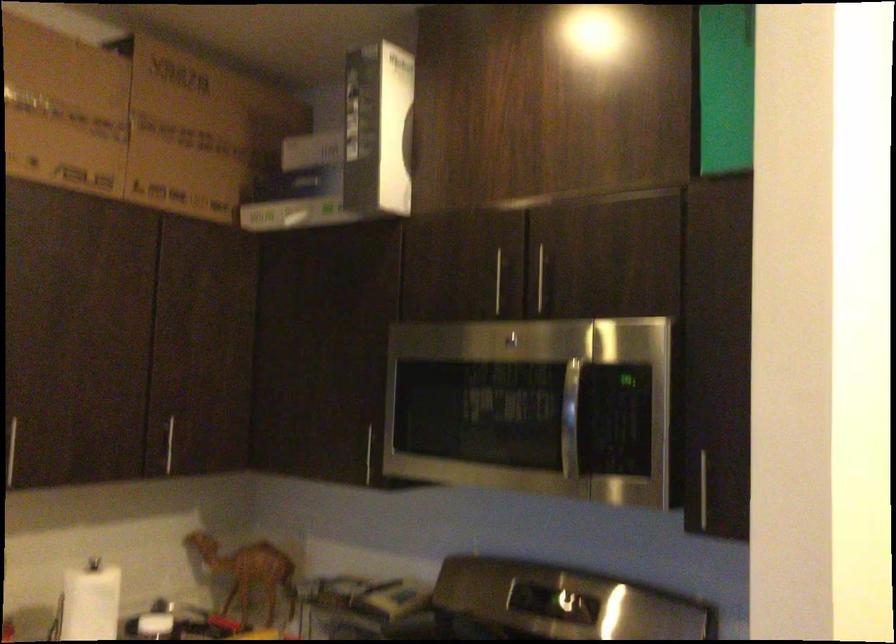
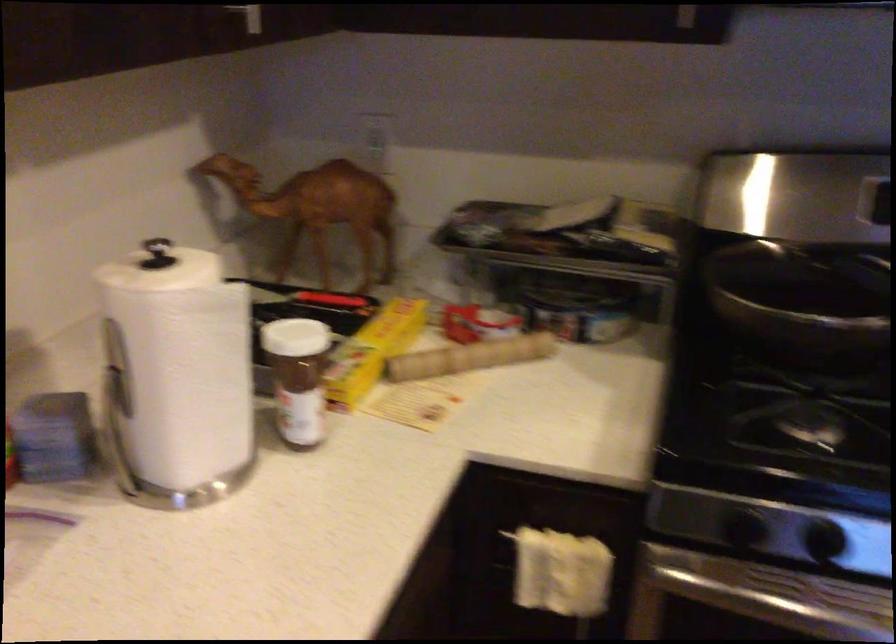
The point at [236,563] is marked in the first image. Where is the corresponding point in the second image?

(317, 210)